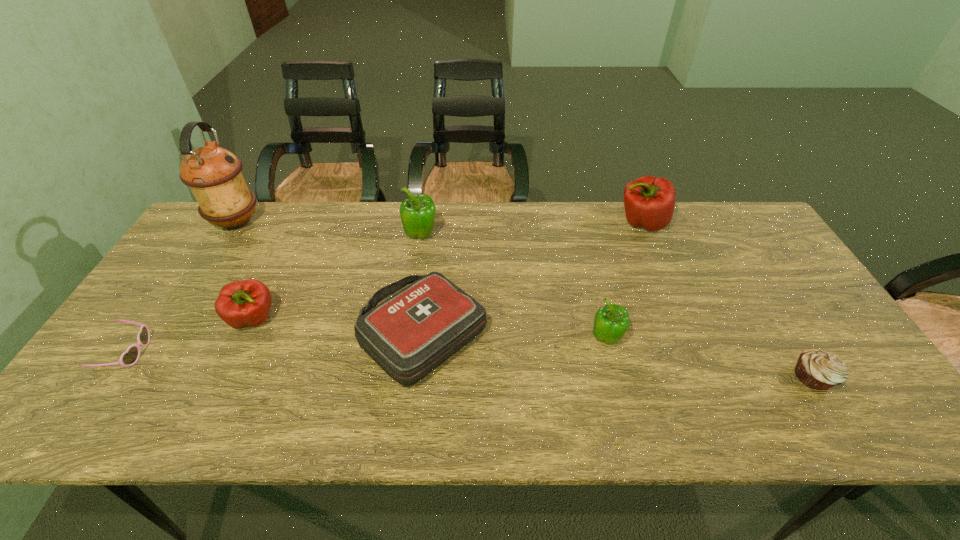
This screenshot has height=540, width=960. In order to click on free space at the right edge of the desktop in this screenshot , I will do `click(750, 292)`.

In the image, there is a desktop. Where is `vacant space at the near left corner`? The height and width of the screenshot is (540, 960). vacant space at the near left corner is located at coordinates (87, 426).

This screenshot has height=540, width=960. Find the location of `free space between the left pink bell pepper and the second bell pepper from left to right`. free space between the left pink bell pepper and the second bell pepper from left to right is located at coordinates pyautogui.click(x=337, y=278).

At what (x,y) coordinates should I click in order to perform the action: click on free area in between the red first-aid kit and the muffin. Please return your answer as a coordinate pair (x, y). This screenshot has height=540, width=960. Looking at the image, I should click on (618, 355).

You are a GUI agent. You are given a task and a screenshot of the screen. Output one action in this format:
    pyautogui.click(x=<x>, y=<y>)
    Task: Click on the free space between the rightmost object and the oil lamp
    The image size is (960, 540).
    Given the screenshot: What is the action you would take?
    pyautogui.click(x=524, y=299)

This screenshot has height=540, width=960. I want to click on unoccupied position between the bigger green bell pepper and the left pink bell pepper, so click(x=337, y=278).

Locate an element on the screen. This screenshot has width=960, height=540. vacant space in between the seventh object from left to right and the third shortest object is located at coordinates (533, 278).

In order to click on vacant area that lies between the second object from right to left and the red first-aid kit in this screenshot , I will do `click(533, 278)`.

I want to click on vacant point located between the left pink bell pepper and the tallest object, so click(245, 271).

Where is `vacant region between the bigger pink bell pepper and the bigger green bell pepper`? vacant region between the bigger pink bell pepper and the bigger green bell pepper is located at coordinates (531, 229).